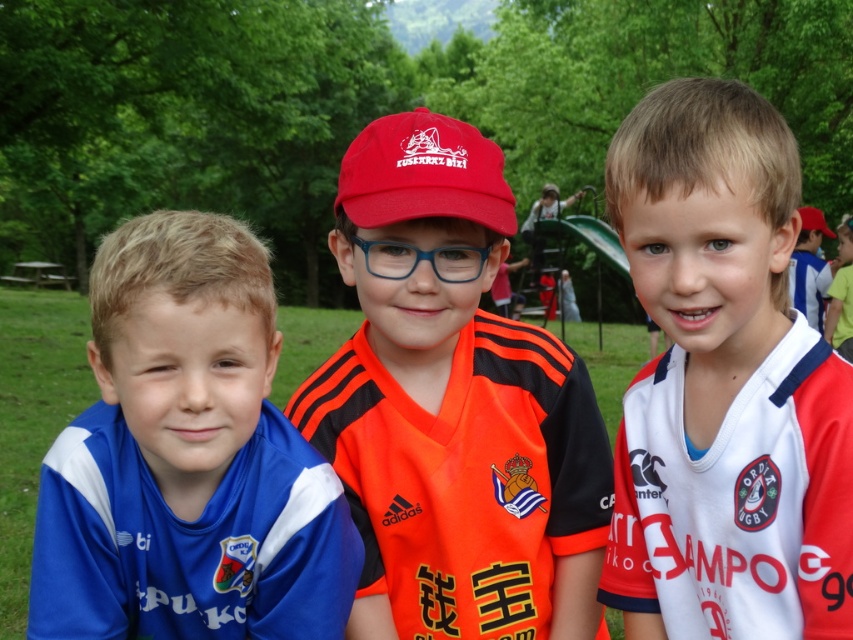
Measure the distance between point (39, 531) and camera.

They are 5.00 feet apart.

Is blue jersey at left smaller than matte red baseball cap at center?

Incorrect, blue jersey at left is not smaller in size than matte red baseball cap at center.

Locate an element on the screen. blue jersey at left is located at coordinates pos(187,458).

I want to click on blue jersey at left, so click(x=187, y=458).

Does white jersey at center have a lesser width compared to matte red baseball cap at center?

No.

Is point (636, 616) positioned in front of point (514, 221)?

No, (636, 616) is behind (514, 221).

This screenshot has width=853, height=640. Find the location of `white jersey at center`. white jersey at center is located at coordinates (724, 385).

Which of these two, white jersey at center or orange jersey at center, stands taller?

With more height is white jersey at center.

Is white jersey at center taller than orange jersey at center?

Yes, white jersey at center is taller than orange jersey at center.

Identify the location of white jersey at center. The height and width of the screenshot is (640, 853). (724, 385).

Where is `white jersey at center`? This screenshot has height=640, width=853. white jersey at center is located at coordinates (724, 385).